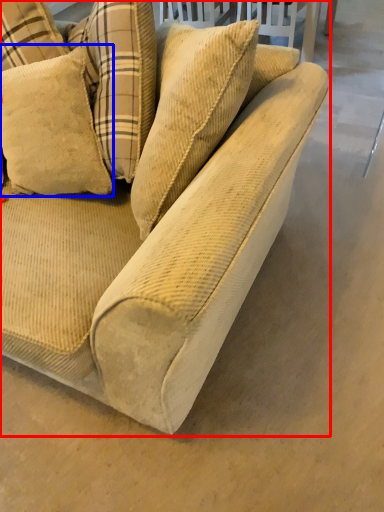
Question: Which object is closer to the camera taking this photo, studio couch (highlighted by a red box) or pillow (highlighted by a blue box)?

Choices:
 (A) studio couch
 (B) pillow

Answer: (A)